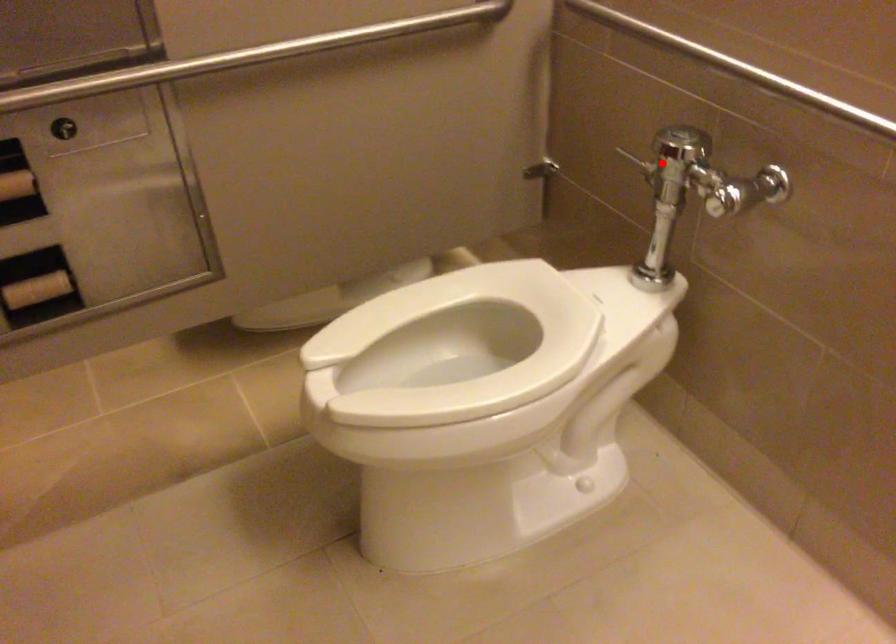
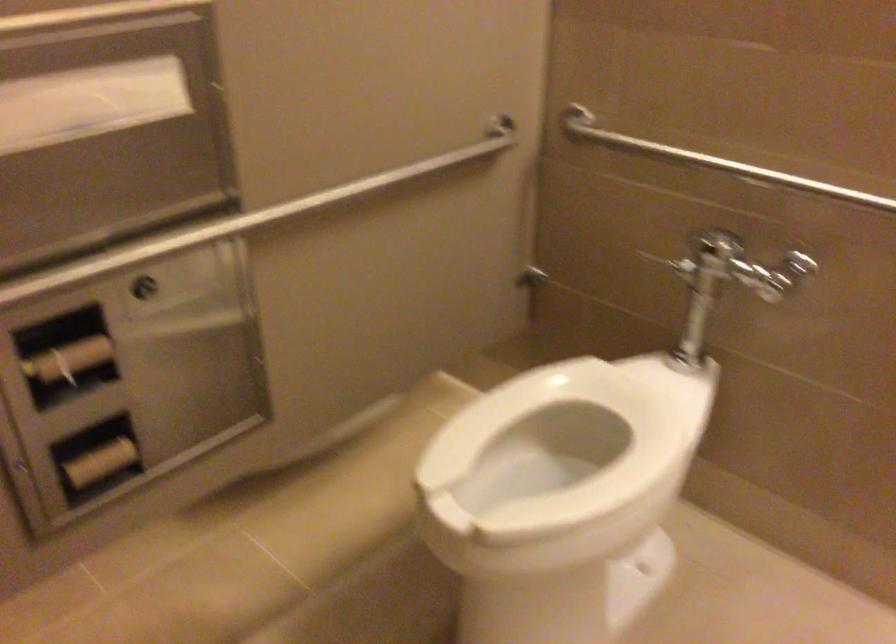
Question: A red point is marked in image1. In image2, is the corresponding 3D point closer to the camera or farther? Reply with the corresponding letter.

Choices:
 (A) The corresponding 3D point is closer.
 (B) The corresponding 3D point is farther.

Answer: (B)